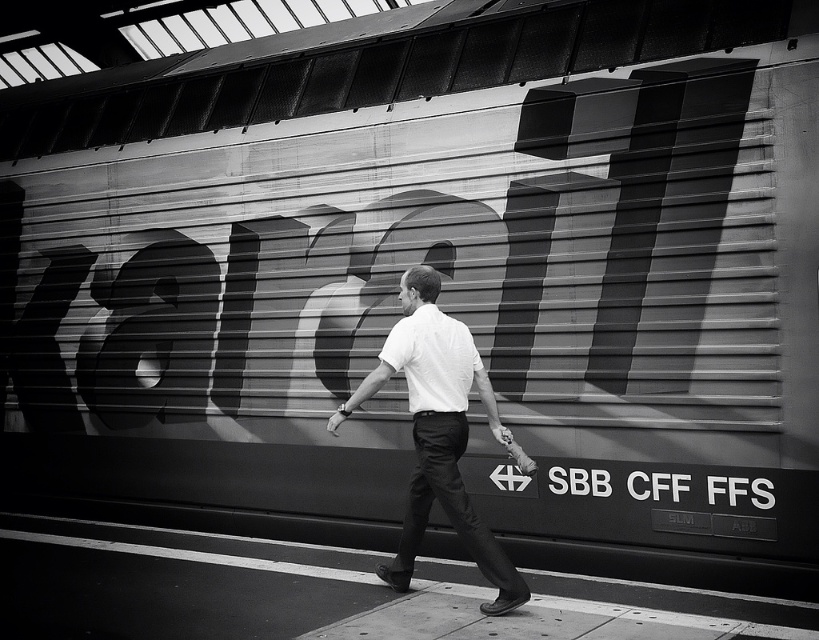
Question: Can you confirm if smooth concrete pavement at center is thinner than white smooth shirt at center?

Choices:
 (A) no
 (B) yes

Answer: (A)

Question: Among these points, which one is farthest from the camera?

Choices:
 (A) 451,433
 (B) 53,625

Answer: (A)

Question: Does smooth concrete pavement at center appear under white smooth shirt at center?

Choices:
 (A) no
 (B) yes

Answer: (B)

Question: Among these objects, which one is farthest from the camera?

Choices:
 (A) white smooth shirt at center
 (B) smooth concrete pavement at center

Answer: (A)

Question: Can you confirm if smooth concrete pavement at center is wider than white smooth shirt at center?

Choices:
 (A) no
 (B) yes

Answer: (B)